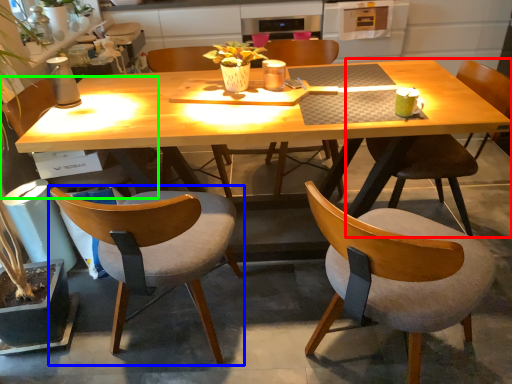
Question: Which object is positioned farthest from chair (highlighted by a red box)? Select from chair (highlighted by a blue box) and chair (highlighted by a green box).

Choices:
 (A) chair
 (B) chair

Answer: (B)